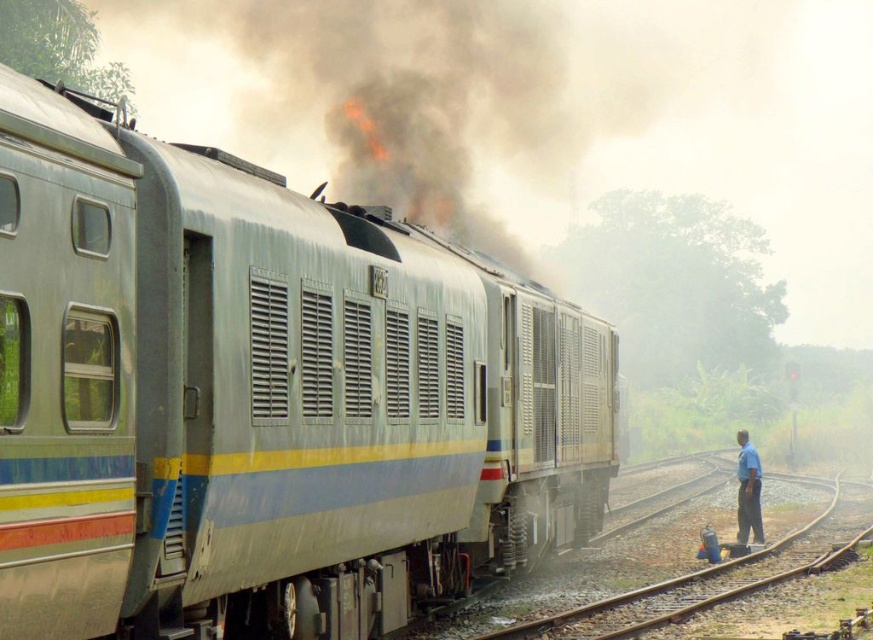
Between metallic train at left and blue shirt at right, which one has more height?

Standing taller between the two is metallic train at left.

Between point (0, 156) and point (741, 518), which one is positioned behind?

The point (741, 518) is more distant.

You are a GUI agent. You are given a task and a screenshot of the screen. Output one action in this format:
    pyautogui.click(x=<x>, y=<y>)
    Task: Click on the metallic train at left
    
    Given the screenshot: What is the action you would take?
    pyautogui.click(x=265, y=397)

This screenshot has height=640, width=873. What are the coordinates of `metallic train at left` in the screenshot? It's located at (265, 397).